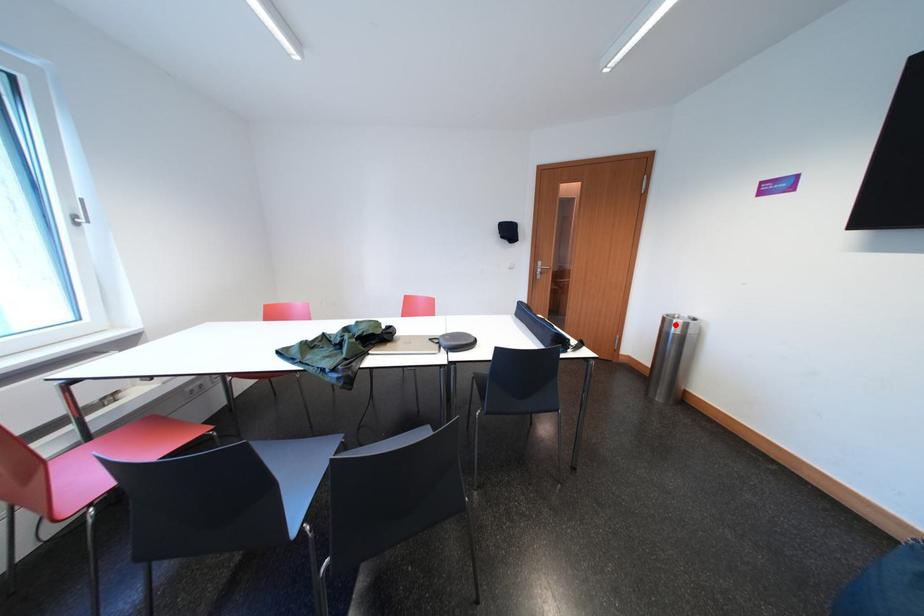
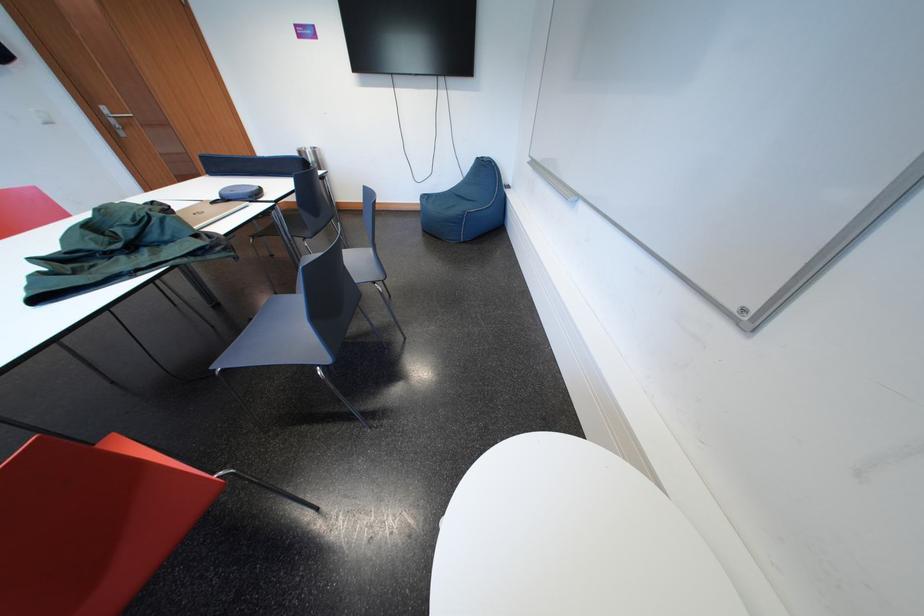
Where in the second image is the point corresponding to the highlighted location from the first image?

(310, 158)